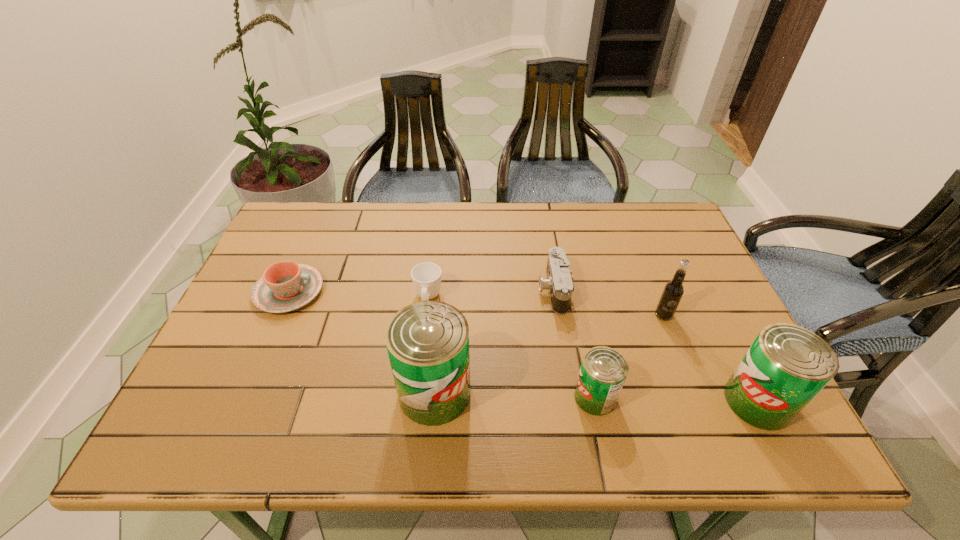
Please point a spot to add another can on the left. Please provide its 2D coordinates. Your answer should be formatted as a tuple, i.e. [(x, y)], where the tuple contains the x and y coordinates of a point satisfying the conditions above.

[(277, 388)]